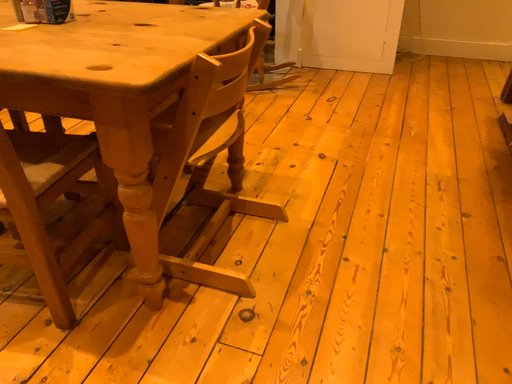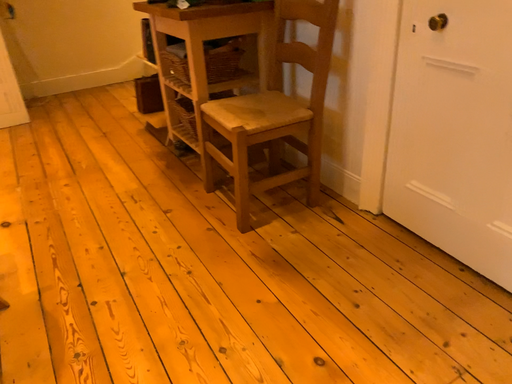
Question: Which way did the camera rotate in the video?

Choices:
 (A) rotated downward
 (B) rotated upward

Answer: (B)